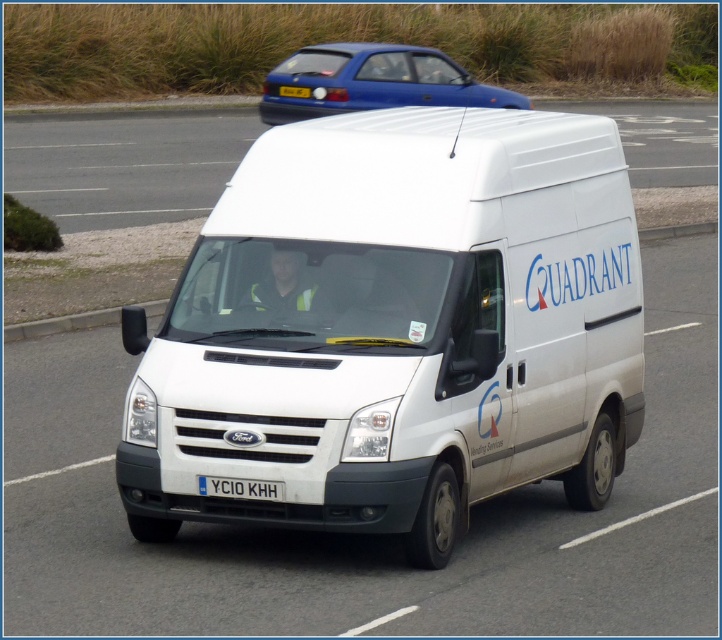
Is metallic blue hatchback at upper center to the right of white plastic license plate at center from the viewer's perspective?

Yes, metallic blue hatchback at upper center is to the right of white plastic license plate at center.

Can you confirm if metallic blue hatchback at upper center is positioned below white plastic license plate at center?

No.

Is point (395, 56) behind point (222, 483)?

Yes, it is behind point (222, 483).

Where is `metallic blue hatchback at upper center`? The width and height of the screenshot is (722, 640). metallic blue hatchback at upper center is located at coordinates (370, 81).

Which is more to the left, white glossy van at center or metallic blue hatchback at upper center?

metallic blue hatchback at upper center

Based on the photo, is white glossy van at center further to camera compared to metallic blue hatchback at upper center?

That is False.

Which is in front, point (91, 138) or point (295, 106)?

Positioned in front is point (295, 106).

Locate an element on the screen. The width and height of the screenshot is (722, 640). white glossy van at center is located at coordinates (123, 163).

Between point (206, 374) and point (253, 492), which one is positioned in front?

Point (253, 492) is in front.

Does white matte van at center come in front of white plastic license plate at center?

Yes, white matte van at center is closer to the viewer.

What do you see at coordinates (395, 328) in the screenshot? This screenshot has width=722, height=640. I see `white matte van at center` at bounding box center [395, 328].

Where is `white matte van at center`? The image size is (722, 640). white matte van at center is located at coordinates (395, 328).